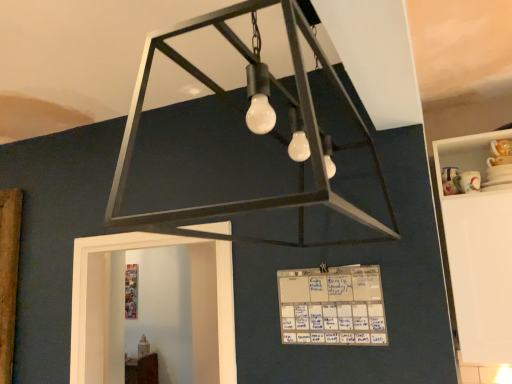
The width and height of the screenshot is (512, 384). What do you see at coordinates (242, 112) in the screenshot?
I see `matte black chandelier at center` at bounding box center [242, 112].

Find the location of `white paper calendar at center`. white paper calendar at center is located at coordinates (332, 306).

What are the coordinates of `white glossy cabinet at right` in the screenshot? It's located at [479, 249].

The image size is (512, 384). Identify the location of matte black chandelier at center. (242, 112).

Measure the distance from matte black chandelier at center to white paper calendar at center.

matte black chandelier at center and white paper calendar at center are 16.29 inches apart.

What's the angular difference between matte black chandelier at center and white paper calendar at center's facing directions?

89.4 degrees separate the facing orientations of matte black chandelier at center and white paper calendar at center.

Do you think matte black chandelier at center is within white paper calendar at center, or outside of it?

matte black chandelier at center is outside white paper calendar at center.

Considering the positions of objects matte black chandelier at center and white paper calendar at center in the image provided, who is more to the left, matte black chandelier at center or white paper calendar at center?

From the viewer's perspective, matte black chandelier at center appears more on the left side.

Is white paper calendar at center inside the boundaries of matte black chandelier at center, or outside?

white paper calendar at center is spatially situated outside matte black chandelier at center.

What's the angular difference between white paper calendar at center and matte black chandelier at center's facing directions?

The facing directions of white paper calendar at center and matte black chandelier at center are 89.4 degrees apart.

This screenshot has width=512, height=384. What are the coordinates of `writing that is below the matte black chandelier at center (from the image's perspective)` in the screenshot? It's located at (332, 306).

Is white paper calendar at center taller than matte black chandelier at center?

Incorrect, the height of white paper calendar at center is not larger of that of matte black chandelier at center.

Which object is further away from the camera taking this photo, white glossy cabinet at right or white paper calendar at center?

Positioned behind is white glossy cabinet at right.

Considering the sizes of objects white glossy cabinet at right and white paper calendar at center in the image provided, who is shorter, white glossy cabinet at right or white paper calendar at center?

white paper calendar at center.

Is white glossy cabinet at right situated inside white paper calendar at center or outside?

white glossy cabinet at right is spatially situated outside white paper calendar at center.

From the image's perspective, would you say white glossy cabinet at right is shown under white paper calendar at center?

Incorrect, from the image's perspective, white glossy cabinet at right is higher than white paper calendar at center.

Considering the sizes of matte black chandelier at center and white glossy cabinet at right in the image, is matte black chandelier at center wider or thinner than white glossy cabinet at right?

Considering their sizes, matte black chandelier at center looks broader than white glossy cabinet at right.

At what (x,y) coordinates should I click in order to perform the action: click on furniture that is below the matte black chandelier at center (from the image's perspective). Please return your answer as a coordinate pair (x, y). Looking at the image, I should click on (x=479, y=249).

From the image's perspective, between matte black chandelier at center and white glossy cabinet at right, which one is located above?

matte black chandelier at center, from the image's perspective.

From a real-world perspective, between matte black chandelier at center and white glossy cabinet at right, who is vertically lower?

From a 3D spatial view, white glossy cabinet at right is below.

Which object is thinner, white glossy cabinet at right or matte black chandelier at center?

Thinner between the two is white glossy cabinet at right.

Considering the relative sizes of white glossy cabinet at right and matte black chandelier at center in the image provided, is white glossy cabinet at right taller than matte black chandelier at center?

Yes.

How different are the orientations of white glossy cabinet at right and matte black chandelier at center in degrees?

The facing directions of white glossy cabinet at right and matte black chandelier at center are 89.1 degrees apart.

Is point (350, 300) behind point (445, 214)?

No, (350, 300) is in front of (445, 214).

Locate an element on the screen. This screenshot has width=512, height=384. furniture that appears on the right of white paper calendar at center is located at coordinates tap(479, 249).

Which of these two, white paper calendar at center or white glossy cabinet at right, stands shorter?

With less height is white paper calendar at center.

From the picture: Is white paper calendar at center inside the boundaries of white glossy cabinet at right, or outside?

white paper calendar at center cannot be found inside white glossy cabinet at right.

Find the location of a particular element. The image size is (512, 384). writing behind the matte black chandelier at center is located at coordinates (332, 306).

This screenshot has width=512, height=384. Identify the location of lamp that is above the white paper calendar at center (from a real-world perspective). (242, 112).

In the scene shown: Which object lies nearer to the anchor point white paper calendar at center, matte black chandelier at center or white glossy cabinet at right?

Among the two, matte black chandelier at center is located nearer to white paper calendar at center.

From the image, which object appears to be farther from white paper calendar at center, white glossy cabinet at right or matte black chandelier at center?

white glossy cabinet at right lies further to white paper calendar at center than the other object.

Based on their spatial positions, is white paper calendar at center or white glossy cabinet at right further from matte black chandelier at center?

white glossy cabinet at right is positioned further to the anchor matte black chandelier at center.

From the image, which object appears to be nearer to white glossy cabinet at right, white paper calendar at center or matte black chandelier at center?

white paper calendar at center is positioned closer to the anchor white glossy cabinet at right.

When comparing their distances from matte black chandelier at center, does white glossy cabinet at right or white paper calendar at center seem further?

Based on the image, white glossy cabinet at right appears to be further to matte black chandelier at center.

Estimate the real-world distances between objects in this image. Which object is closer to white glossy cabinet at right, matte black chandelier at center or white paper calendar at center?

white paper calendar at center lies closer to white glossy cabinet at right than the other object.

This screenshot has height=384, width=512. Identify the location of writing positioned between matte black chandelier at center and white glossy cabinet at right from near to far. tap(332, 306).